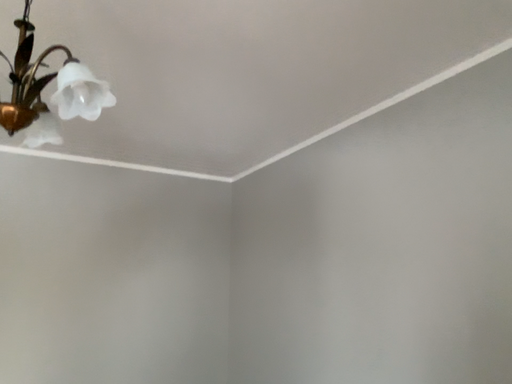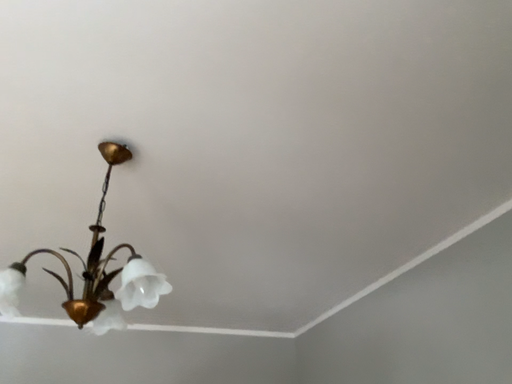
Question: Which way did the camera rotate in the video?

Choices:
 (A) rotated right
 (B) rotated left

Answer: (B)